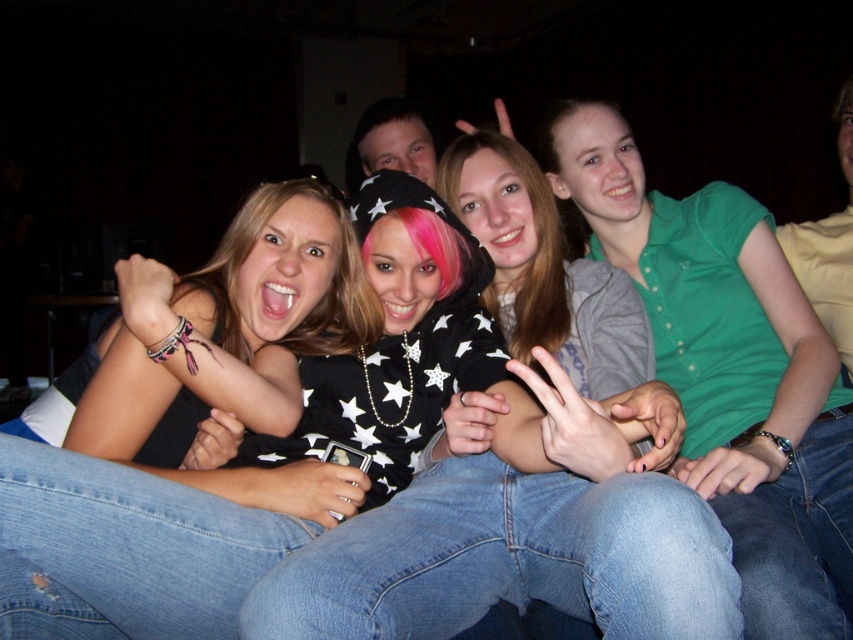
Looking at this image, does denim jeans at center have a greater height compared to ripped denim jeans at lower left?

In fact, denim jeans at center may be shorter than ripped denim jeans at lower left.

Which is in front, point (399, 531) or point (3, 465)?

Positioned in front is point (3, 465).

This screenshot has height=640, width=853. Find the location of `denim jeans at center`. denim jeans at center is located at coordinates (508, 560).

Is point (144, 614) farther from viewer compared to point (807, 506)?

No, (144, 614) is in front of (807, 506).

Does ripped denim jeans at lower left have a greater width compared to jeans at lower right?

No.

You are a GUI agent. You are given a task and a screenshot of the screen. Output one action in this format:
    pyautogui.click(x=<x>, y=<y>)
    Task: Click on the ripped denim jeans at lower left
    
    Given the screenshot: What is the action you would take?
    pyautogui.click(x=125, y=548)

Is black star-patterned hoodie at center wider than ripped denim jeans at lower left?

Yes, black star-patterned hoodie at center is wider than ripped denim jeans at lower left.

Does black star-patterned hoodie at center have a greater height compared to ripped denim jeans at lower left?

Yes, black star-patterned hoodie at center is taller than ripped denim jeans at lower left.

Does point (397, 406) lie in front of point (164, 563)?

No, it is not.

You are a GUI agent. You are given a task and a screenshot of the screen. Output one action in this format:
    pyautogui.click(x=<x>, y=<y>)
    Task: Click on the black star-patterned hoodie at center
    Image resolution: width=853 pixels, height=640 pixels.
    Given the screenshot: What is the action you would take?
    pyautogui.click(x=125, y=550)